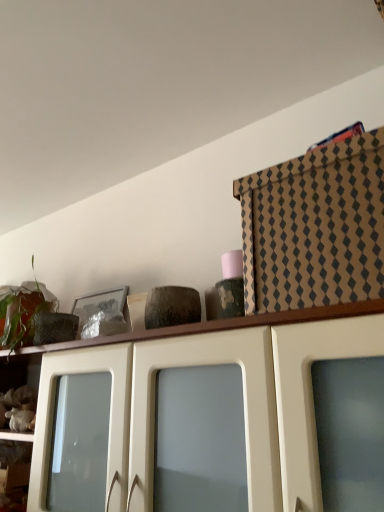
Question: Should I look upward or downward to see matte white cabinet at upper center, positioned as the 1th cabinetry in bottom-to-top order?

Choices:
 (A) down
 (B) up

Answer: (A)

Question: Is matte white cabinet at upper center, positioned as the 1th cabinetry in bottom-to-top order, a part of green matte plant at upper left?

Choices:
 (A) no
 (B) yes

Answer: (A)

Question: From the image's perspective, does green matte plant at upper left appear lower than matte white cabinet at upper center, positioned as the 1th cabinetry in bottom-to-top order?

Choices:
 (A) no
 (B) yes

Answer: (A)

Question: Considering the relative sizes of green matte plant at upper left and matte white cabinet at upper center, positioned as the 1th cabinetry in bottom-to-top order, in the image provided, is green matte plant at upper left wider than matte white cabinet at upper center, positioned as the 1th cabinetry in bottom-to-top order,?

Choices:
 (A) yes
 (B) no

Answer: (B)

Question: Can we say green matte plant at upper left lies outside matte white cabinet at upper center, positioned as the 1th cabinetry in bottom-to-top order?

Choices:
 (A) yes
 (B) no

Answer: (A)

Question: Can you confirm if green matte plant at upper left is positioned to the left of matte white cabinet at upper center, positioned as the 1th cabinetry in bottom-to-top order?

Choices:
 (A) yes
 (B) no

Answer: (A)

Question: Does green matte plant at upper left have a smaller size compared to matte white cabinet at upper center, positioned as the 1th cabinetry in bottom-to-top order?

Choices:
 (A) no
 (B) yes

Answer: (B)

Question: Can you confirm if brown cardboard box at upper right, placed as the 2th cabinetry when sorted from bottom to top, is smaller than matte white cabinet at upper center, positioned as the 1th cabinetry in bottom-to-top order?

Choices:
 (A) yes
 (B) no

Answer: (A)

Question: Is the position of brown cardboard box at upper right, placed as the 2th cabinetry when sorted from bottom to top, less distant than that of matte white cabinet at upper center, positioned as the 1th cabinetry in bottom-to-top order?

Choices:
 (A) yes
 (B) no

Answer: (B)

Question: Does brown cardboard box at upper right, which ranks as the 1th cabinetry in top-to-bottom order, touch matte white cabinet at upper center, positioned as the 1th cabinetry in bottom-to-top order?

Choices:
 (A) no
 (B) yes

Answer: (A)

Question: Is brown cardboard box at upper right, which ranks as the 1th cabinetry in top-to-bottom order, positioned far away from matte white cabinet at upper center, positioned as the 1th cabinetry in bottom-to-top order?

Choices:
 (A) yes
 (B) no

Answer: (B)

Question: Considering the relative sizes of brown cardboard box at upper right, placed as the 2th cabinetry when sorted from bottom to top, and matte white cabinet at upper center, positioned as the 1th cabinetry in bottom-to-top order, in the image provided, is brown cardboard box at upper right, placed as the 2th cabinetry when sorted from bottom to top, bigger than matte white cabinet at upper center, positioned as the 1th cabinetry in bottom-to-top order,?

Choices:
 (A) no
 (B) yes

Answer: (A)

Question: From a real-world perspective, is brown cardboard box at upper right, which ranks as the 1th cabinetry in top-to-bottom order, positioned over matte white cabinet at upper center, arranged as the second cabinetry when viewed from the top, based on gravity?

Choices:
 (A) no
 (B) yes

Answer: (B)

Question: Does brown cardboard box at upper right, which ranks as the 1th cabinetry in top-to-bottom order, have a lesser height compared to green matte plant at upper left?

Choices:
 (A) no
 (B) yes

Answer: (B)